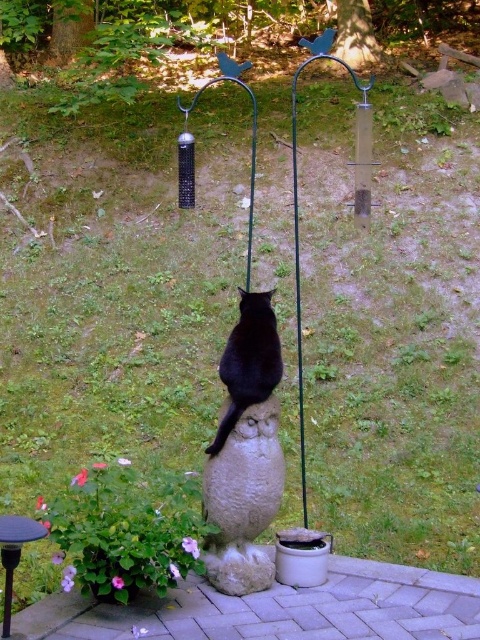
Can you confirm if white stone owl at center is shorter than metallic black stool at lower left?

In fact, white stone owl at center may be taller than metallic black stool at lower left.

How distant is white stone owl at center from metallic black stool at lower left?

white stone owl at center and metallic black stool at lower left are 26.17 inches apart from each other.

The height and width of the screenshot is (640, 480). What are the coordinates of `white stone owl at center` in the screenshot? It's located at (242, 500).

Can you confirm if metallic green swing at center is thinner than black matte cat at center?

In fact, metallic green swing at center might be wider than black matte cat at center.

What do you see at coordinates (297, 202) in the screenshot? I see `metallic green swing at center` at bounding box center [297, 202].

Locate an element on the screen. The height and width of the screenshot is (640, 480). metallic green swing at center is located at coordinates (297, 202).

Can you confirm if black matte cat at center is positioned below metallic black stool at lower left?

No.

Which is in front, point (236, 356) or point (7, 529)?

Point (7, 529) is in front.

Locate an element on the screen. The image size is (480, 640). black matte cat at center is located at coordinates (249, 360).